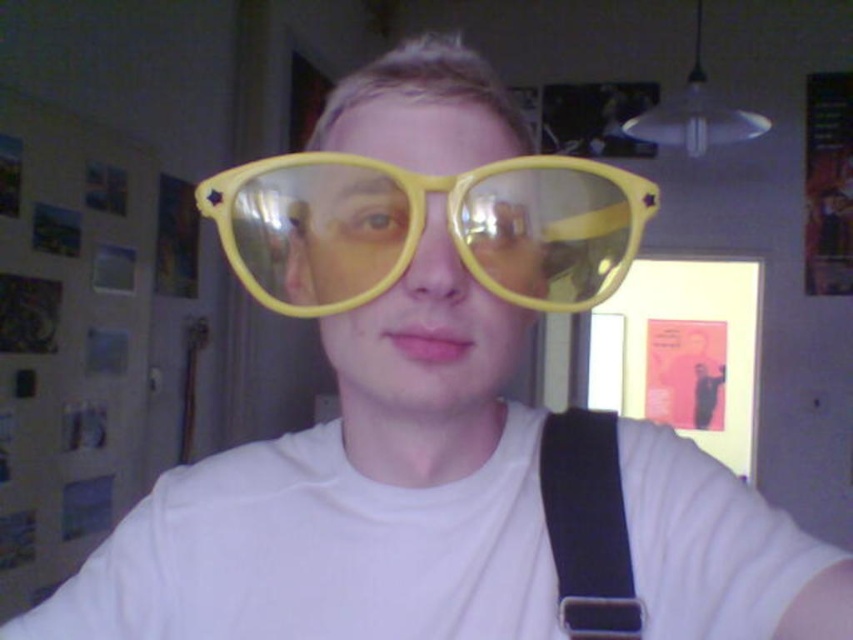
You are trying to determine if the yellow plastic goggles at center can be worn without the black fabric strap at center getting in the way. Based on their positions and sizes, is there enough space between them?

The yellow plastic goggles at center might be wider than black fabric strap at center, so there may not be enough space between them, which could cause the strap to interfere when wearing the goggles.